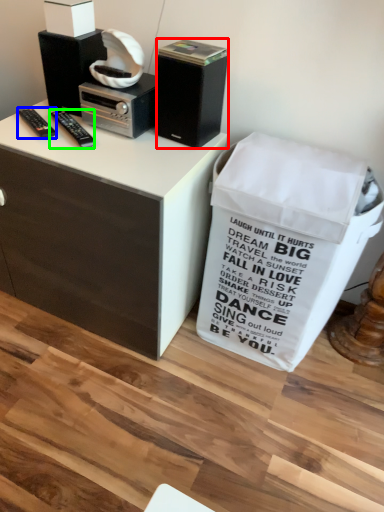
Question: Which object is positioned farthest from loudspeaker (highlighted by a red box)? Select from remote control (highlighted by a blue box) and remote control (highlighted by a green box).

Choices:
 (A) remote control
 (B) remote control

Answer: (A)